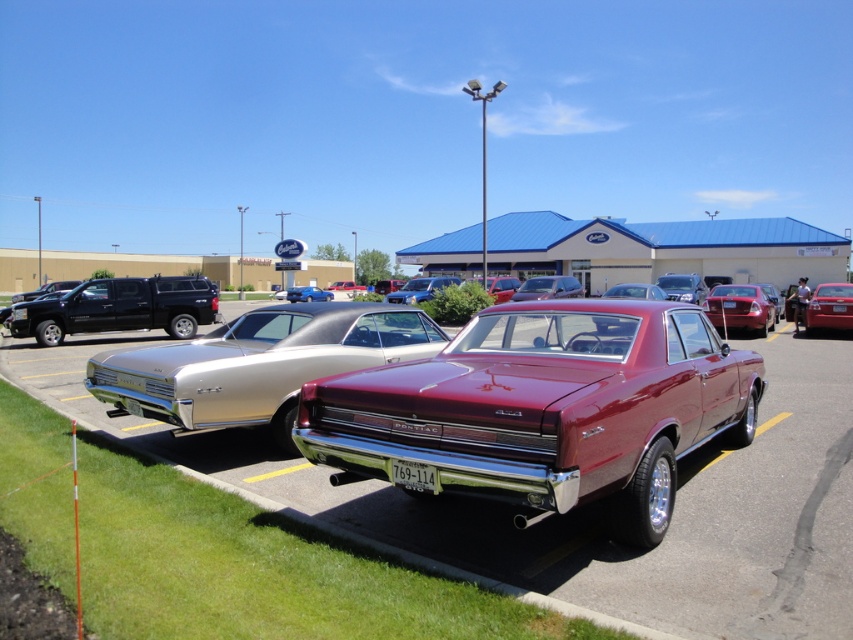
Is glossy metallic sedan at right thinner than glossy blue sedan at center?

Yes.

Which is behind, point (759, 332) or point (405, 296)?

Point (405, 296)

I want to click on glossy metallic sedan at right, so click(740, 307).

Which is above, shiny maroon sedan at center or glossy blue sedan at center?

glossy blue sedan at center

Between shiny maroon sedan at center and glossy blue sedan at center, which one has less height?

With less height is glossy blue sedan at center.

What do you see at coordinates (543, 410) in the screenshot? This screenshot has height=640, width=853. I see `shiny maroon sedan at center` at bounding box center [543, 410].

You are a GUI agent. You are given a task and a screenshot of the screen. Output one action in this format:
    pyautogui.click(x=<x>, y=<y>)
    Task: Click on the shiny maroon sedan at center
    
    Given the screenshot: What is the action you would take?
    pyautogui.click(x=543, y=410)

Is metallic silver car at center shorter than shiny maroon sedan at center?

Yes, metallic silver car at center is shorter than shiny maroon sedan at center.

Between point (779, 403) and point (593, 444), which one is positioned in front?

Positioned in front is point (593, 444).

Locate an element on the screen. This screenshot has height=640, width=853. metallic silver car at center is located at coordinates (590, 506).